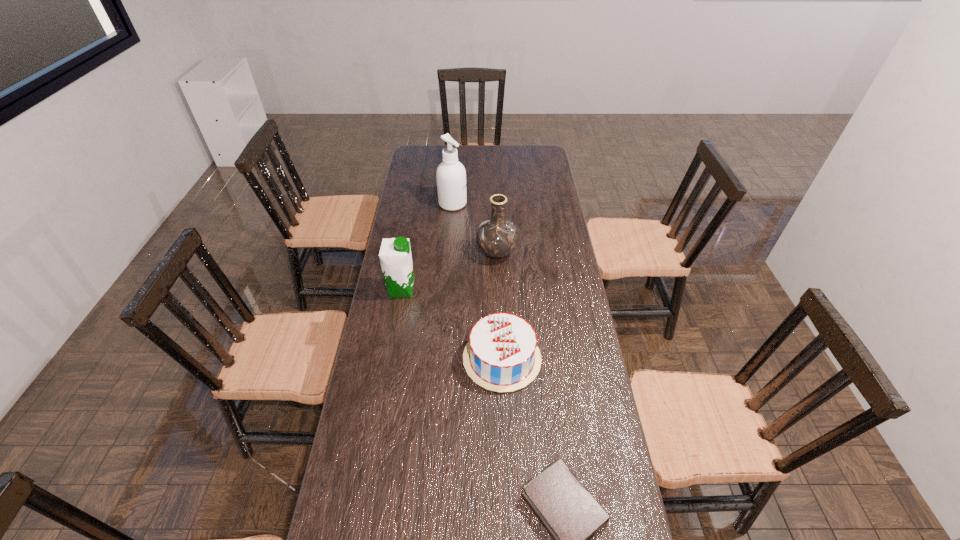
Locate an element on the screen. The height and width of the screenshot is (540, 960). the tallest object is located at coordinates (451, 176).

Locate an element on the screen. This screenshot has height=540, width=960. cleansing agent is located at coordinates (451, 176).

Identify the location of vase. (497, 237).

Locate an element on the screen. soya milk is located at coordinates (395, 256).

The height and width of the screenshot is (540, 960). Identify the location of the leftmost object. (395, 256).

The image size is (960, 540). Find the location of `birthday cake`. birthday cake is located at coordinates (502, 355).

Identify the location of the fourth farthest object. The width and height of the screenshot is (960, 540). (502, 355).

Identify the location of vacant area situated 0.380m on the front label of the cleansing agent. The image size is (960, 540). (549, 204).

I want to click on free spot located on the back of the fourth nearest object, so click(495, 231).

This screenshot has height=540, width=960. What are the coordinates of `blank space located on the front-facing side of the soya milk` in the screenshot? It's located at (491, 289).